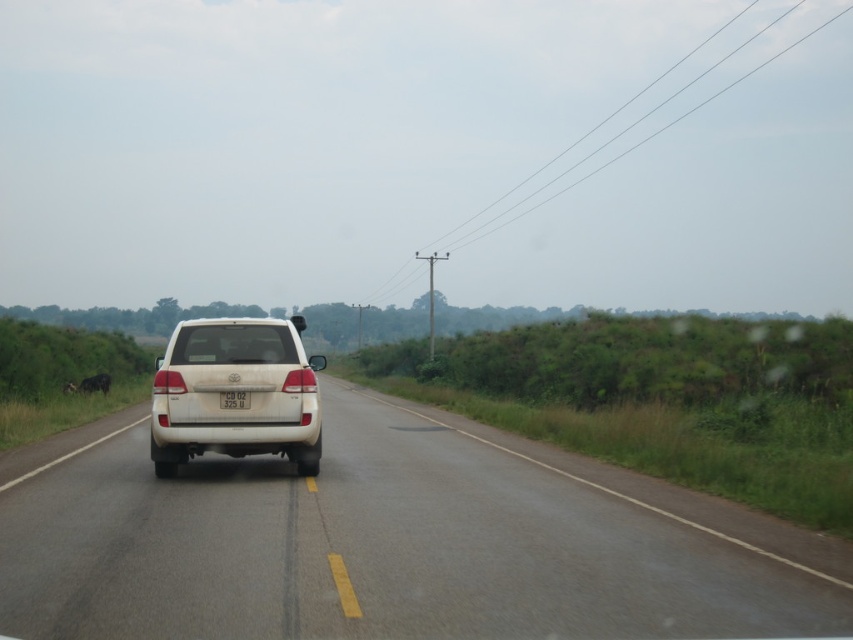
You are a wildlife photographer observing the scene. You see the white glossy suv at center and the dark brown fur at left. Which object is bigger in size?

The white glossy suv at center is larger in size than dark brown fur at left.

You are a driver approaching the road and see the dark brown fur at left and the white plastic license plate at center. Which object is wider?

The dark brown fur at left might be wider than white plastic license plate at center.